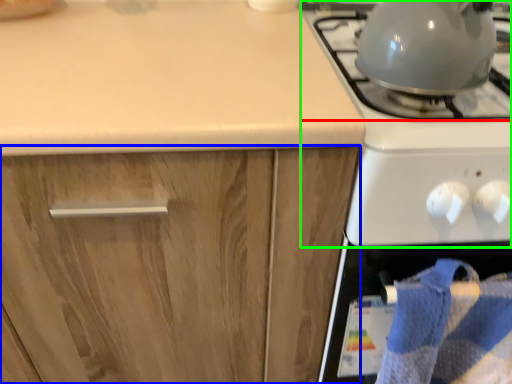
Question: Which object is positioned closest to gas stove (highlighted by a red box)? Select from cabinetry (highlighted by a blue box) and gas stove (highlighted by a green box).

Choices:
 (A) cabinetry
 (B) gas stove

Answer: (B)